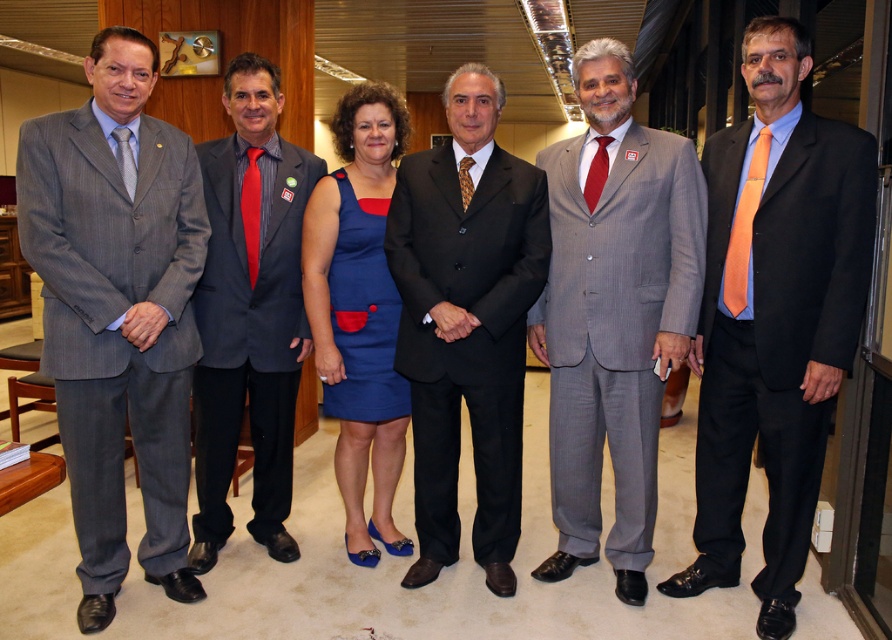
Question: Can you confirm if gray pinstripe suit at left is positioned above blue fabric dress at center?

Choices:
 (A) no
 (B) yes

Answer: (A)

Question: Where is striped fabric suit at center located in relation to blue fabric dress at center in the image?

Choices:
 (A) above
 (B) below

Answer: (A)

Question: Which is farther from the gray pinstripe suit at center?

Choices:
 (A) gray pinstripe suit at left
 (B) black satin suit at center
 (C) blue fabric dress at center
 (D) orange silk suit at right

Answer: (A)

Question: Can you confirm if gray pinstripe suit at left is positioned to the right of orange silk suit at right?

Choices:
 (A) no
 (B) yes

Answer: (A)

Question: Which object is closer to the camera taking this photo?

Choices:
 (A) blue fabric dress at center
 (B) black satin suit at center

Answer: (B)

Question: Which object is positioned farthest from the gray pinstripe suit at left?

Choices:
 (A) gray pinstripe suit at center
 (B) blue fabric dress at center
 (C) black satin suit at center
 (D) orange silk suit at right

Answer: (D)